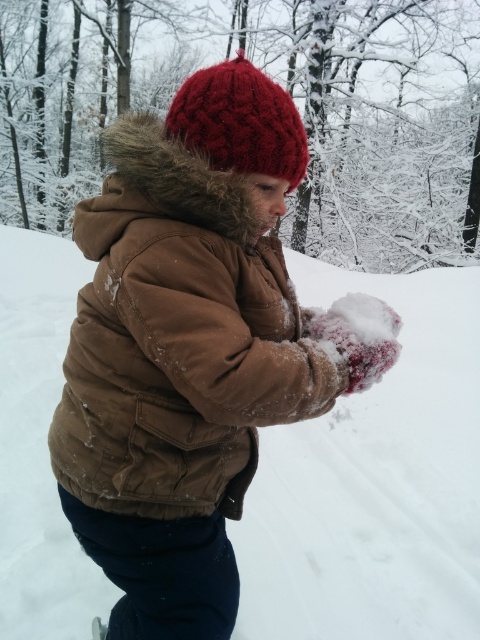
Question: Can you confirm if white fluffy snow at center is bigger than brown cotton jacket at center?

Choices:
 (A) no
 (B) yes

Answer: (A)

Question: Is white fluffy snow at center further to the viewer compared to brown cotton jacket at center?

Choices:
 (A) yes
 (B) no

Answer: (A)

Question: Which object appears closest to the camera in this image?

Choices:
 (A) white fluffy snow at center
 (B) brown cotton jacket at center
 (C) knitted red hat at upper center

Answer: (B)

Question: Which object is the farthest from the white fluffy snow at center?

Choices:
 (A) brown cotton jacket at center
 (B) knitted red hat at upper center

Answer: (B)

Question: Which point is farther to the camera?

Choices:
 (A) knitted red hat at upper center
 (B) white fluffy snow at center
 (C) brown cotton jacket at center

Answer: (B)

Question: Is white fluffy snow at center below knitted red hat at upper center?

Choices:
 (A) yes
 (B) no

Answer: (A)